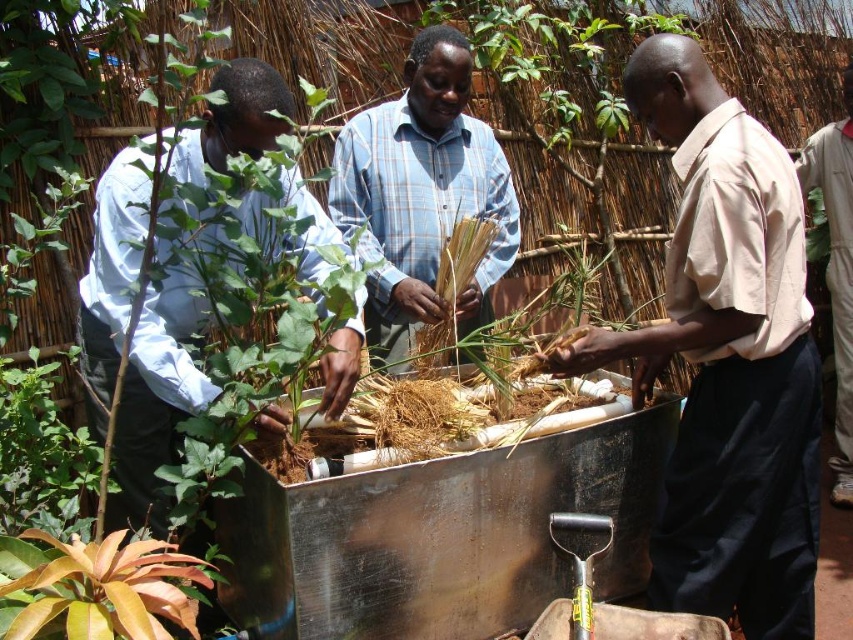
Question: Which object is positioned closest to the light blue shirt at left?

Choices:
 (A) leathery brown leaf at lower left
 (B) blue plaid shirt at center
 (C) beige cotton shirt at center

Answer: (A)

Question: Does blue plaid shirt at center have a greater width compared to leathery brown leaf at lower left?

Choices:
 (A) yes
 (B) no

Answer: (A)

Question: From the image, what is the correct spatial relationship of light blue shirt at left in relation to blue plaid shirt at center?

Choices:
 (A) above
 (B) below

Answer: (B)

Question: Which of the following is the farthest from the observer?

Choices:
 (A) (718, 445)
 (B) (158, 392)

Answer: (A)

Question: Is beige cotton shirt at center smaller than blue plaid shirt at center?

Choices:
 (A) yes
 (B) no

Answer: (B)

Question: Estimate the real-world distances between objects in this image. Which object is closer to the beige cotton shirt at center?

Choices:
 (A) blue plaid shirt at center
 (B) leathery brown leaf at lower left
 (C) light blue shirt at left

Answer: (A)